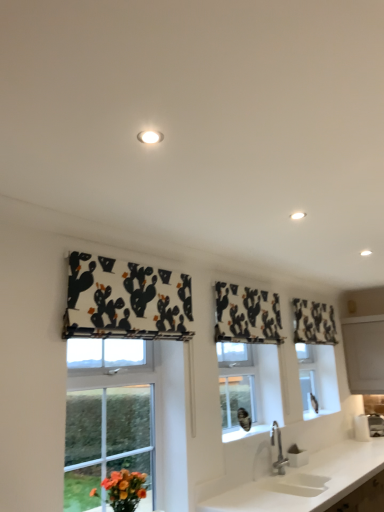
Question: Can you confirm if black printed fabric at center, which appears as the second curtain when viewed from the front, is thinner than white glossy light fixture at upper center?

Choices:
 (A) no
 (B) yes

Answer: (B)

Question: Is black printed fabric at center, which appears as the second curtain when viewed from the front, facing towards white glossy light fixture at upper center?

Choices:
 (A) no
 (B) yes

Answer: (B)

Question: Is black printed fabric at center, which appears as the second curtain when viewed from the front, shorter than white glossy light fixture at upper center?

Choices:
 (A) no
 (B) yes

Answer: (A)

Question: From the image's perspective, does black printed fabric at center, arranged as the second curtain when viewed from the left, appear lower than white glossy light fixture at upper center?

Choices:
 (A) yes
 (B) no

Answer: (A)

Question: From a real-world perspective, does black printed fabric at center, which is counted as the 2th curtain, starting from the back, sit lower than white glossy light fixture at upper center?

Choices:
 (A) yes
 (B) no

Answer: (A)

Question: Is black printed fabric at upper center, acting as the 1th curtain starting from the back, wider or thinner than white glossy light fixture at upper center?

Choices:
 (A) thin
 (B) wide

Answer: (A)

Question: In terms of height, does black printed fabric at upper center, the 1th curtain positioned from the right, look taller or shorter compared to white glossy light fixture at upper center?

Choices:
 (A) short
 (B) tall

Answer: (B)

Question: In the image, is black printed fabric at upper center, the 1th curtain positioned from the right, on the left side or the right side of white glossy light fixture at upper center?

Choices:
 (A) right
 (B) left

Answer: (A)

Question: From the image's perspective, is black printed fabric at upper center, acting as the third curtain starting from the left, positioned above or below white glossy light fixture at upper center?

Choices:
 (A) above
 (B) below

Answer: (B)

Question: Looking at their shapes, would you say white glossy light fixture at upper center is wider or thinner than white matte countertop at lower center?

Choices:
 (A) wide
 (B) thin

Answer: (B)

Question: Looking at the image, does white glossy light fixture at upper center seem bigger or smaller compared to white matte countertop at lower center?

Choices:
 (A) small
 (B) big

Answer: (A)

Question: Considering their positions, is white glossy light fixture at upper center located in front of or behind white matte countertop at lower center?

Choices:
 (A) behind
 (B) front

Answer: (A)

Question: Considering the positions of point (291, 216) and point (271, 481), is point (291, 216) closer or farther from the camera than point (271, 481)?

Choices:
 (A) farther
 (B) closer

Answer: (B)

Question: Is point (307, 342) closer or farther from the camera than point (327, 499)?

Choices:
 (A) farther
 (B) closer

Answer: (A)

Question: From a real-world perspective, relative to white matte countertop at lower center, is black printed fabric at upper center, the 1th curtain positioned from the right, vertically above or below?

Choices:
 (A) below
 (B) above

Answer: (B)